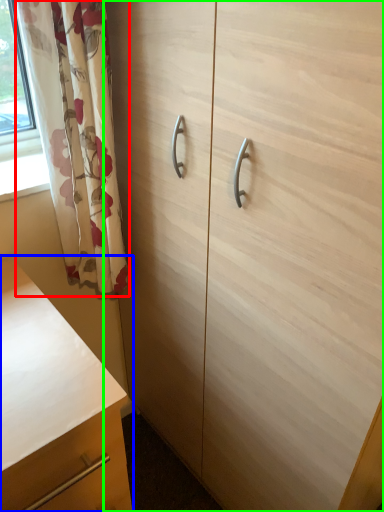
Question: Which object is positioned farthest from curtain (highlighted by a red box)? Select from chest of drawers (highlighted by a blue box) and cabinetry (highlighted by a green box).

Choices:
 (A) chest of drawers
 (B) cabinetry

Answer: (A)